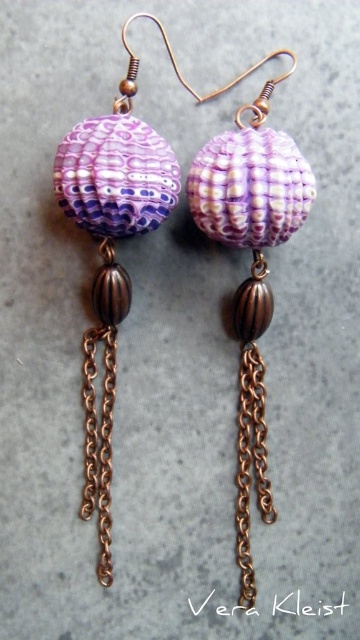
You are an appraiser examining the earrings. You notice the matte purple shell at left and the copper chain at lower center. Which object is positioned in front of the other?

The matte purple shell at left is closer to the viewer than the copper chain at lower center, so it is positioned in front of the copper chain at lower center.

You are a jewelry designer trying to create a matching necklace. You have the matte purple shell at left and the copper chain at lower center. Which one should you use as the focal point of the necklace to ensure it stands out more?

The matte purple shell at left has a larger size compared to the copper chain at lower center, so it should be used as the focal point to ensure it stands out more.

You are a jeweler examining the earrings. You need to determine which object has a greater width between the matte purple shell at left and the copper chain at center. Based on the image, which one is wider?

The matte purple shell at left is wider than the copper chain at center according to the description.